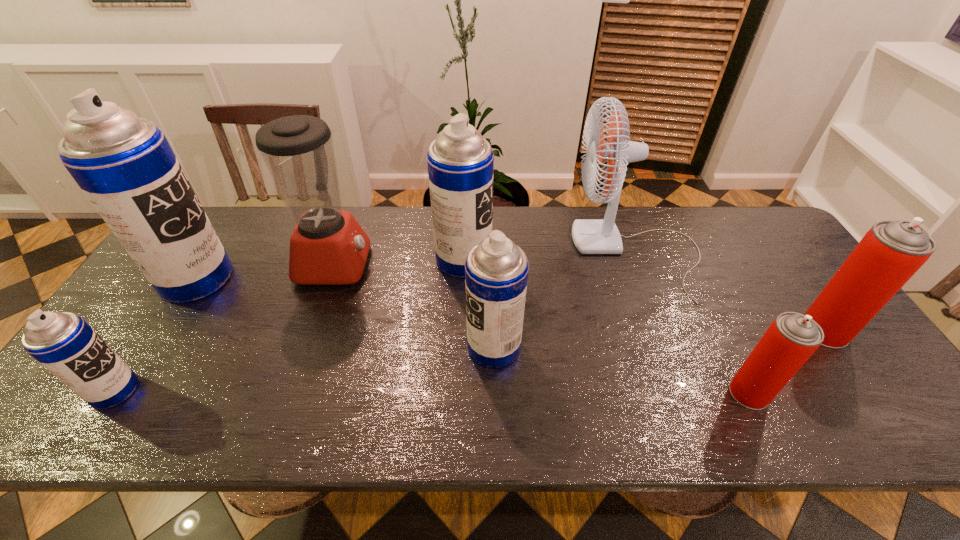
The height and width of the screenshot is (540, 960). I want to click on the smallest blue aerosol can, so (64, 343).

I want to click on free space located on the label side of the tallest object, so click(x=300, y=279).

The width and height of the screenshot is (960, 540). Find the location of `free spot located on the label side of the second tallest aerosol can`. free spot located on the label side of the second tallest aerosol can is located at coordinates (621, 260).

At what (x,y) coordinates should I click in order to perform the action: click on free region located on the front-facing side of the orange fan. Please return your answer as a coordinate pair (x, y). The width and height of the screenshot is (960, 540). Looking at the image, I should click on (467, 254).

I want to click on vacant space located on the front-facing side of the orange fan, so click(x=457, y=254).

In order to click on vacant region located 0.110m on the front-facing side of the orange fan in this screenshot , I will do `click(539, 254)`.

Find the location of a particular element. The height and width of the screenshot is (540, 960). vacant space situated on the front of the blender near the controls is located at coordinates (427, 263).

Locate an element on the screen. free space located 0.230m on the back of the farther red aerosol can is located at coordinates (772, 255).

The height and width of the screenshot is (540, 960). What are the coordinates of `free point located on the label side of the second smallest blue aerosol can` in the screenshot? It's located at (383, 347).

Find the location of a particular element. blank area located 0.210m on the label side of the second smallest blue aerosol can is located at coordinates (383, 347).